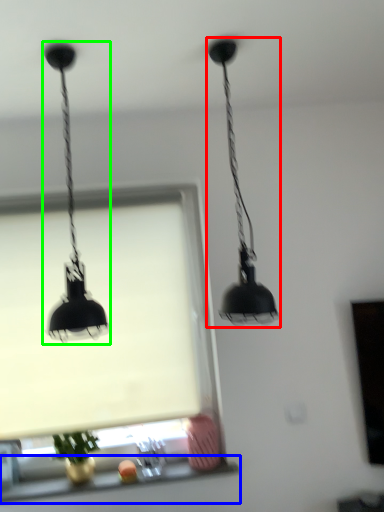
Question: Considering the real-world distances, which object is farthest from lamp (highlighted by a red box)? window sill (highlighted by a blue box) or lamp (highlighted by a green box)?

Choices:
 (A) window sill
 (B) lamp

Answer: (A)